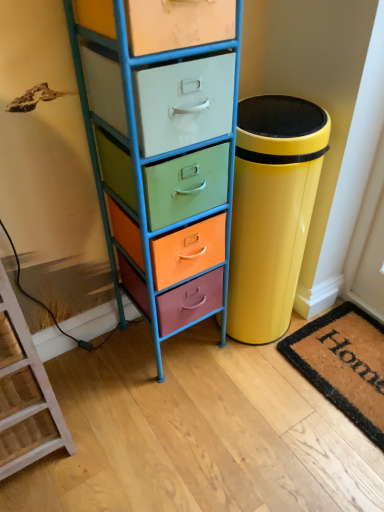
Question: Is glossy yellow trash can at right surrounding coir doormat at lower right?

Choices:
 (A) no
 (B) yes

Answer: (A)

Question: Does glossy yellow trash can at right have a greater width compared to coir doormat at lower right?

Choices:
 (A) yes
 (B) no

Answer: (A)

Question: Is glossy yellow trash can at right oriented away from coir doormat at lower right?

Choices:
 (A) yes
 (B) no

Answer: (B)

Question: From the image's perspective, does glossy yellow trash can at right appear lower than coir doormat at lower right?

Choices:
 (A) yes
 (B) no

Answer: (B)

Question: Is glossy yellow trash can at right next to coir doormat at lower right?

Choices:
 (A) yes
 (B) no

Answer: (B)

Question: Based on their sizes in the image, would you say glossy yellow trash can at right is bigger or smaller than wooden ladder at lower left?

Choices:
 (A) small
 (B) big

Answer: (B)

Question: Does point (273, 261) appear closer or farther from the camera than point (34, 358)?

Choices:
 (A) closer
 (B) farther

Answer: (B)

Question: Is glossy yellow trash can at right taller or shorter than wooden ladder at lower left?

Choices:
 (A) short
 (B) tall

Answer: (A)

Question: From the image's perspective, relative to wooden ladder at lower left, is glossy yellow trash can at right above or below?

Choices:
 (A) above
 (B) below

Answer: (A)

Question: From a real-world perspective, is glossy yellow trash can at right above or below coir doormat at lower right?

Choices:
 (A) below
 (B) above

Answer: (B)

Question: Looking at their shapes, would you say glossy yellow trash can at right is wider or thinner than coir doormat at lower right?

Choices:
 (A) wide
 (B) thin

Answer: (A)

Question: Is glossy yellow trash can at right to the left or to the right of coir doormat at lower right in the image?

Choices:
 (A) left
 (B) right

Answer: (A)

Question: Relative to coir doormat at lower right, is glossy yellow trash can at right in front or behind?

Choices:
 (A) front
 (B) behind

Answer: (A)

Question: Choose the correct answer: Is wooden ladder at lower left inside coir doormat at lower right or outside it?

Choices:
 (A) inside
 (B) outside

Answer: (B)

Question: Is point (19, 415) closer or farther from the camera than point (377, 396)?

Choices:
 (A) closer
 (B) farther

Answer: (A)